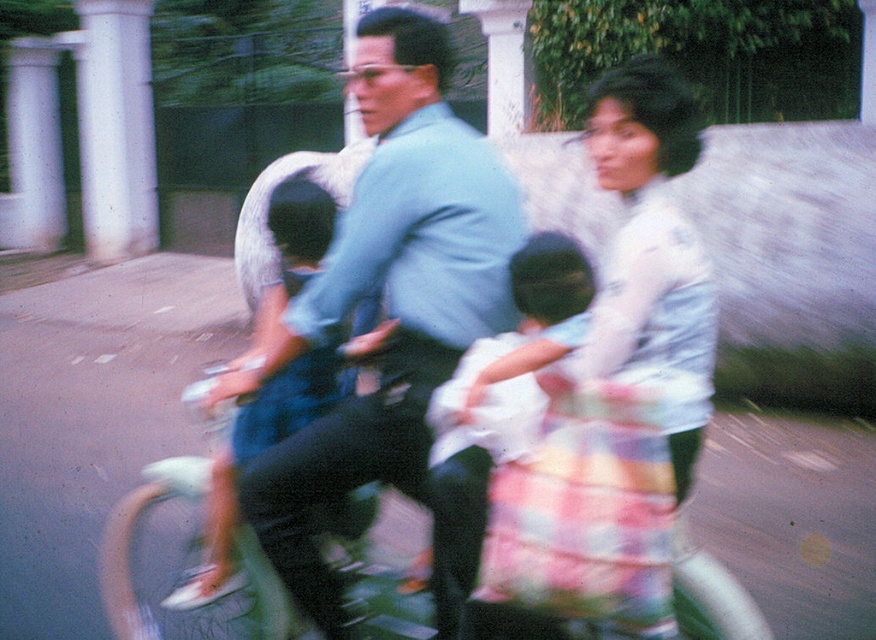
Question: Which object is the farthest from the white satin blouse at center?

Choices:
 (A) light blue shirt at center
 (B) metallic green bicycle at center

Answer: (B)

Question: Which of the following is the farthest from the observer?

Choices:
 (A) white cotton dress at center
 (B) white satin blouse at center
 (C) metallic green bicycle at center
 (D) light blue denim shorts at center

Answer: (C)

Question: Does white satin blouse at center appear on the left side of light blue denim shorts at center?

Choices:
 (A) no
 (B) yes

Answer: (A)

Question: Can you confirm if light blue shirt at center is smaller than light blue denim shorts at center?

Choices:
 (A) no
 (B) yes

Answer: (A)

Question: Among these points, which one is farthest from the camera?

Choices:
 (A) (605, 145)
 (B) (710, 564)

Answer: (B)

Question: Does light blue shirt at center lie in front of white satin blouse at center?

Choices:
 (A) yes
 (B) no

Answer: (B)